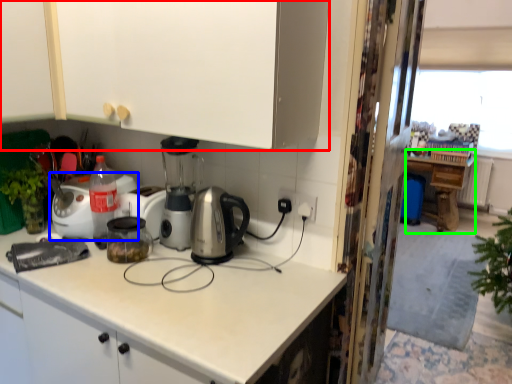
Question: Based on their relative distances, which object is nearer to cabinetry (highlighted by a red box)? Choose from home appliance (highlighted by a blue box) and table (highlighted by a green box).

Choices:
 (A) home appliance
 (B) table

Answer: (A)